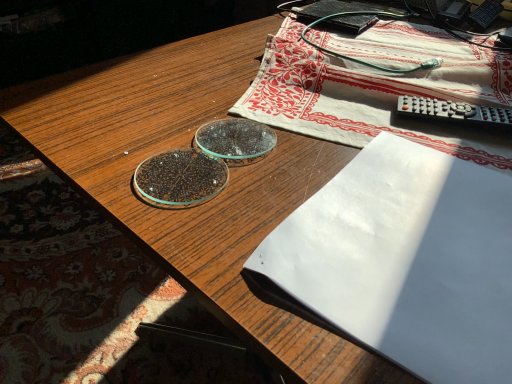
The height and width of the screenshot is (384, 512). Find the location of `free area below white paper at center (from a real-world perspective)`. free area below white paper at center (from a real-world perspective) is located at coordinates (424, 239).